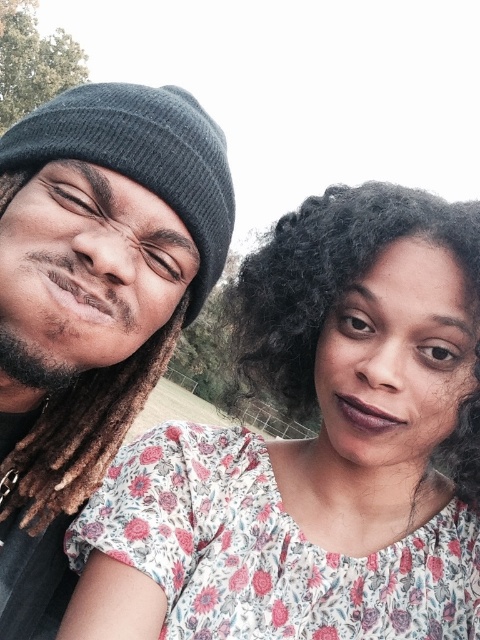
Question: Is dark gray knit beanie at left positioned behind brown dreadlocks at left?

Choices:
 (A) no
 (B) yes

Answer: (A)

Question: Where is curly dark brown hair at upper right located in relation to brown dreadlocks at left in the image?

Choices:
 (A) above
 (B) below

Answer: (A)

Question: Estimate the real-world distances between objects in this image. Which object is farther from the brown dreadlocks at left?

Choices:
 (A) dark gray knit beanie at left
 (B) curly dark brown hair at upper right

Answer: (B)

Question: Which point is farther to the camera?

Choices:
 (A) curly dark brown hair at upper right
 (B) dark gray knit beanie at left

Answer: (A)

Question: Where is dark gray knit beanie at left located in relation to curly dark brown hair at upper right in the image?

Choices:
 (A) right
 (B) left

Answer: (B)

Question: Based on their relative distances, which object is farther from the dark gray knit beanie at left?

Choices:
 (A) brown dreadlocks at left
 (B) curly dark brown hair at upper right

Answer: (B)